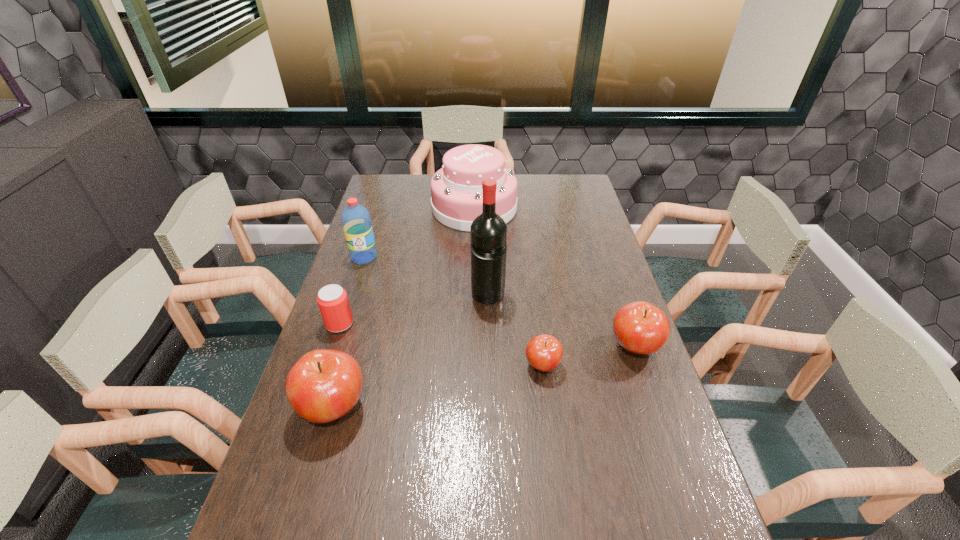
Where is `water bottle present at the left edge`? The image size is (960, 540). water bottle present at the left edge is located at coordinates (356, 221).

Find the location of a particular element. The height and width of the screenshot is (540, 960). object that is at the right edge is located at coordinates (639, 327).

The width and height of the screenshot is (960, 540). In the image, there is a desktop. Identify the location of vacant space at the far edge. tap(537, 190).

This screenshot has height=540, width=960. I want to click on vacant region at the left edge of the desktop, so click(x=343, y=428).

Find the location of `vacant space at the right edge of the desktop`. vacant space at the right edge of the desktop is located at coordinates (653, 472).

The image size is (960, 540). Identify the location of free space at the far left corner of the desktop. (389, 199).

You are a GUI agent. You are given a task and a screenshot of the screen. Output one action in this format:
    pyautogui.click(x=<x>, y=<y>)
    Task: Click on the vacant area at the far right corner of the desktop
    The image size is (960, 540).
    Given the screenshot: What is the action you would take?
    pyautogui.click(x=585, y=202)

The height and width of the screenshot is (540, 960). What are the coordinates of `free space between the cake and the second shortest object` in the screenshot? It's located at (407, 266).

Find the location of `empty space that is in between the shortest apple and the leftmost apple`. empty space that is in between the shortest apple and the leftmost apple is located at coordinates [438, 386].

Where is `vacant space in between the third farthest object and the beer can`? vacant space in between the third farthest object and the beer can is located at coordinates (414, 310).